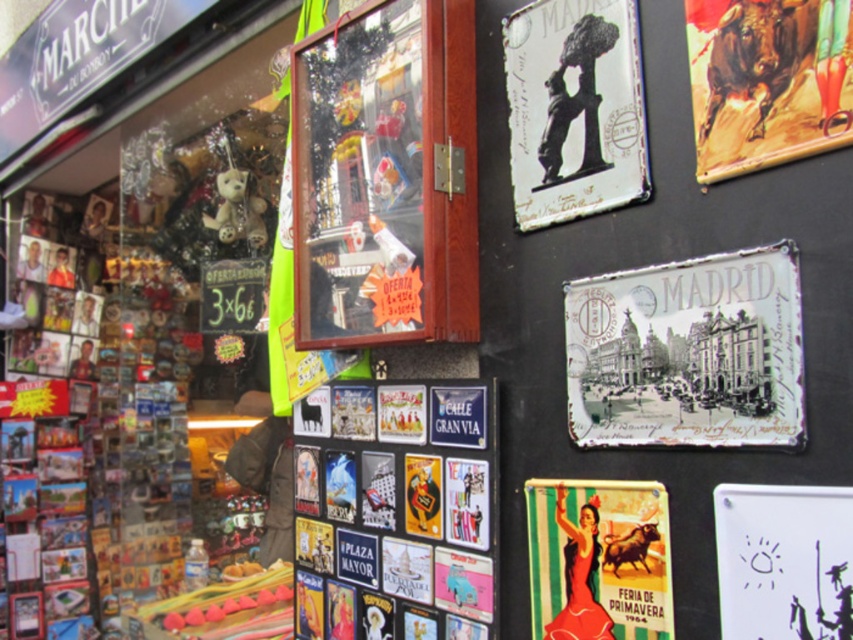
You are a tourist in Madrid holding a souvenir that is 30 cm wide. You want to place it on either the metallic glass display at center or the metallic bull at upper right. Which one can accommodate your souvenir?

The metallic glass display at center has a larger width than the metallic bull at upper right, so the souvenir will fit on the metallic glass display at center.

You are standing in front of the wall with tin signs in Madrid. There are two points marked on the wall at coordinates point (633,356) and point (613,44). Which point is closer to you?

Point (633,356) is closer to the camera than point (613,44).

You are a tourist in Madrid and want to take a photo of both the metallic bull at upper right and the fuzzy white teddy bear at left in the same frame. Your camera has a maximum focus range of 6 feet. Will you be able to capture both objects in one photo?

The metallic bull at upper right and fuzzy white teddy bear at left are 6.12 feet apart from each other. Since the distance between them exceeds the camera maximum focus range of 6 feet, you won